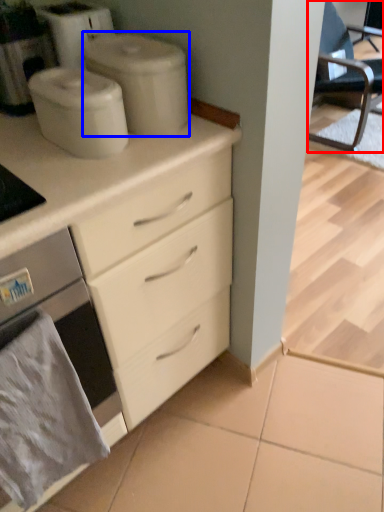
Question: Which point is further to the camera, chair (highlighted by a red box) or appliance (highlighted by a blue box)?

Choices:
 (A) chair
 (B) appliance

Answer: (A)